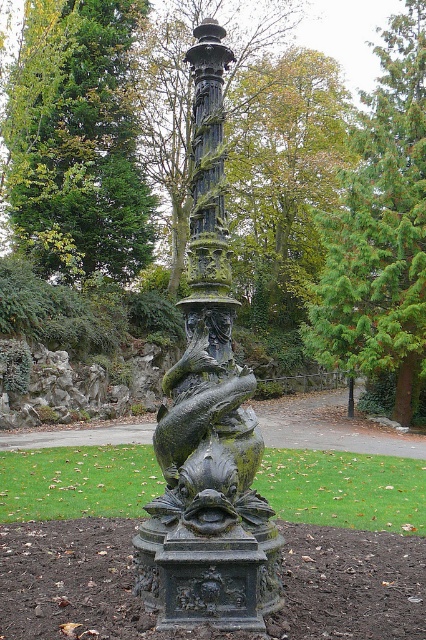
Does green textured tree at upper center have a greater width compared to bronze textured column at center?

Yes, green textured tree at upper center is wider than bronze textured column at center.

Is point (391, 54) positioned in front of point (203, 26)?

No, it is not.

Who is more forward, [383,67] or [195,275]?

Point [195,275]

This screenshot has height=640, width=426. Identify the location of green textured tree at upper center. (380, 228).

Who is positioned more to the left, green leafy tree at center or bronze textured column at center?

green leafy tree at center is more to the left.

This screenshot has height=640, width=426. What do you see at coordinates (77, 141) in the screenshot?
I see `green leafy tree at center` at bounding box center [77, 141].

Locate an element on the screen. green leafy tree at center is located at coordinates (77, 141).

At what (x,y) coordinates should I click in order to perform the action: click on green patina column at center. Please return your answer as a coordinate pair (x, y). Image resolution: width=426 pixels, height=640 pixels. Looking at the image, I should click on (209, 419).

Is green patina column at center thinner than bronze textured column at center?

No.

At what (x,y) coordinates should I click in order to perform the action: click on green patina column at center. Please return your answer as a coordinate pair (x, y). Image resolution: width=426 pixels, height=640 pixels. Looking at the image, I should click on (209, 419).

Where is `green patina column at center`? Image resolution: width=426 pixels, height=640 pixels. green patina column at center is located at coordinates (209, 419).